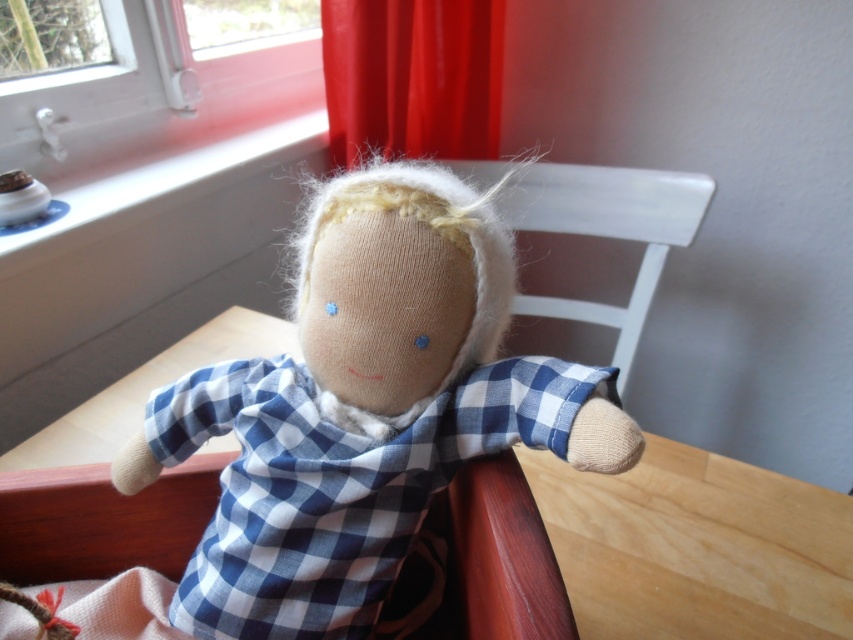
Please describe the exact location of the woolen doll at center in the image using coordinates.

The woolen doll at center is located at coordinates point (x=367, y=413).

You are standing in the room where the handmade doll is seated on the wooden chair. You want to place a small potted plant on the smooth white window sill at upper left. The coordinates given are in a normalized system where the bottom left corner is the origin. Is the point at coordinates point (x=148, y=108) suitable for placing the plant?

The point (x=148, y=108) marks the smooth white window sill at upper left, so yes, placing the plant there would be suitable as it is on the window sill.

You are a photographer trying to capture a closeup of the doll. You notice two points in the scene marked as point 1 at coordinates point (473, 426) and point 2 at coordinates point (328, 102). Which point should you focus on to ensure the doll is in sharp focus?

You should focus on point 1 at coordinates point (473, 426) because it is closer to the camera than point 2 at coordinates point (328, 102), ensuring the doll will be in sharp focus.